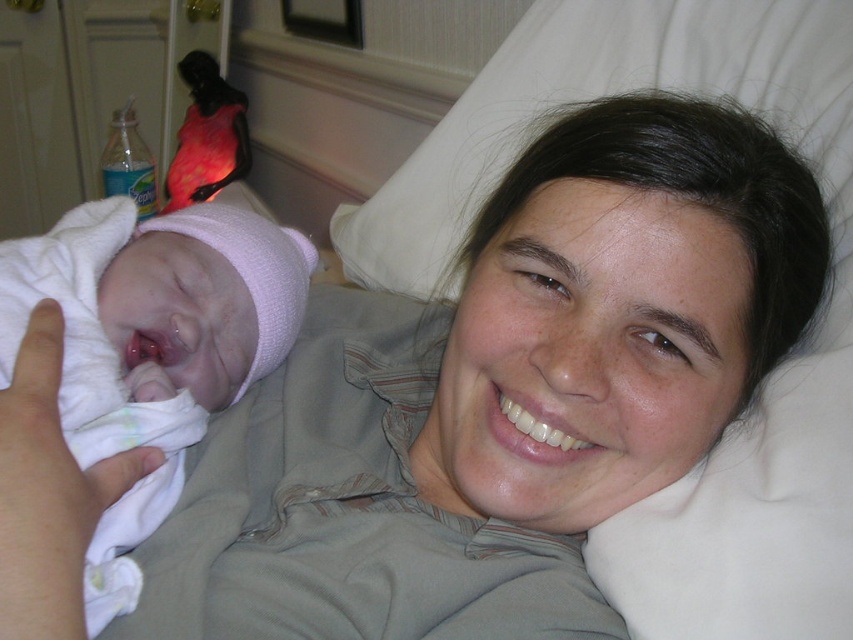
Does white soft cloth at left have a greater height compared to shiny pink parrot at upper left?

No, white soft cloth at left is not taller than shiny pink parrot at upper left.

Identify the location of white soft cloth at left. This screenshot has height=640, width=853. (151, 344).